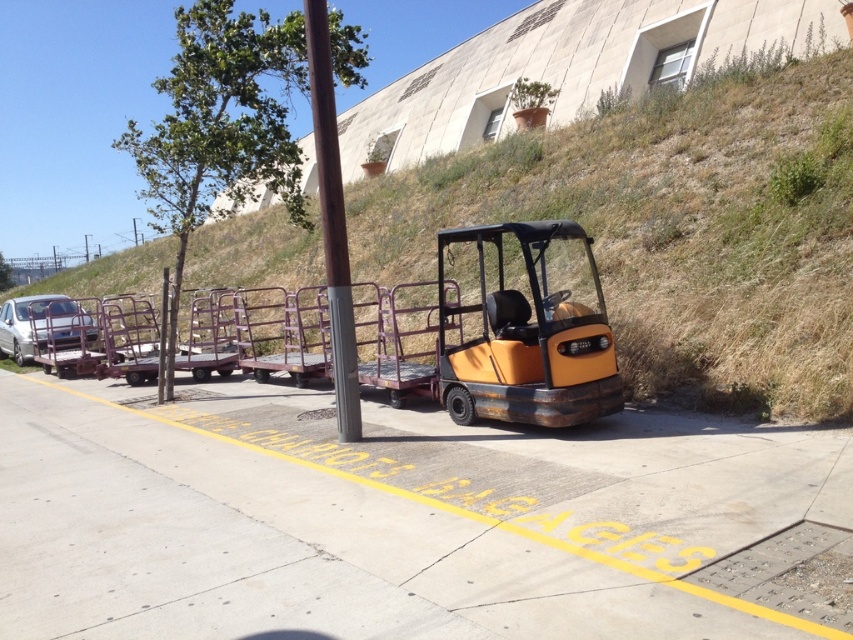
Is orange matte forklift at center taller than brown wood pole at center?

Correct, orange matte forklift at center is much taller as brown wood pole at center.

Can you confirm if orange matte forklift at center is positioned above brown wood pole at center?

No.

From the picture: Who is more distant from viewer, (561,289) or (328,262)?

Positioned behind is point (561,289).

Image resolution: width=853 pixels, height=640 pixels. I want to click on orange matte forklift at center, so [x=531, y=332].

Based on the photo, which of these two, orange metallic forklift at center or brown wood pole at center, stands shorter?

brown wood pole at center

The height and width of the screenshot is (640, 853). Find the location of `orange metallic forklift at center`. orange metallic forklift at center is located at coordinates (674, 230).

Where is `orange metallic forklift at center`? orange metallic forklift at center is located at coordinates (674, 230).

Which is behind, point (326, 145) or point (51, 340)?

Positioned behind is point (51, 340).

Is brown wood pole at center wider than silver metallic car at left?

Incorrect, brown wood pole at center's width does not surpass silver metallic car at left's.

The image size is (853, 640). Describe the element at coordinates (332, 221) in the screenshot. I see `brown wood pole at center` at that location.

Find the location of a particular element. The width and height of the screenshot is (853, 640). brown wood pole at center is located at coordinates (332, 221).